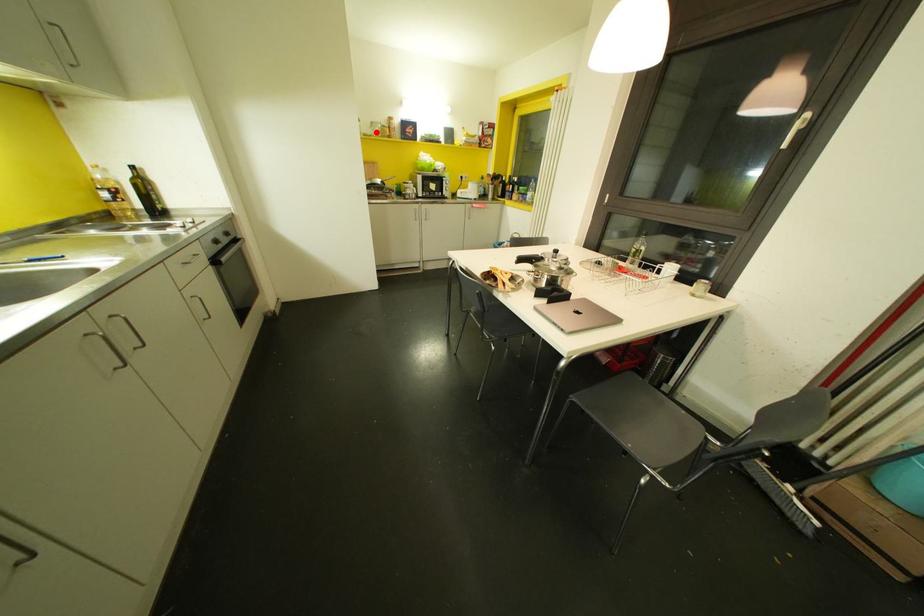
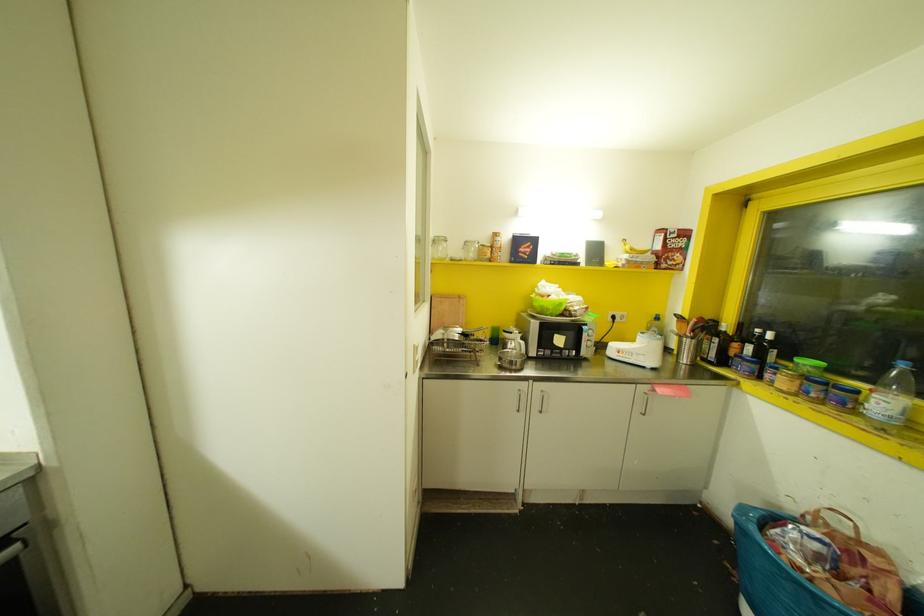
The point at the highlighted location is marked in the first image. Where is the corresponding point in the second image?

(470, 254)